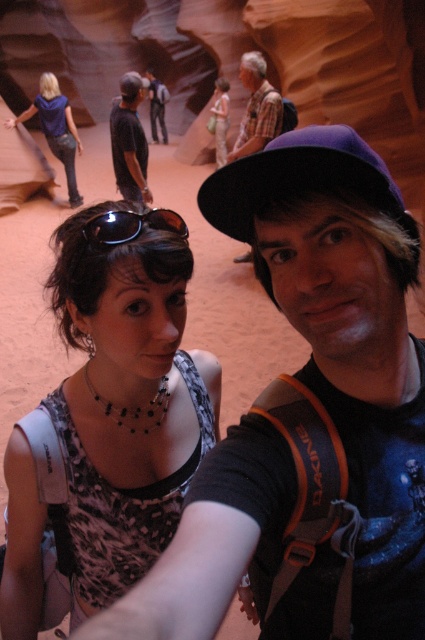
Does matte black hat at center have a greater width compared to matte blue shirt at upper left?

No.

Consider the image. Which is more to the right, matte black hat at center or matte blue shirt at upper left?

matte black hat at center is more to the right.

Locate an element on the screen. The height and width of the screenshot is (640, 425). matte black hat at center is located at coordinates (308, 416).

Between plaid shirt at center and sunglasses at center, which one appears on the right side from the viewer's perspective?

plaid shirt at center is more to the right.

Consider the image. Which is above, plaid shirt at center or sunglasses at center?

plaid shirt at center is higher up.

Who is more forward, (254, 122) or (119, 214)?

Point (119, 214) is more forward.

This screenshot has width=425, height=640. Identify the location of plaid shirt at center. (257, 108).

Who is lower down, sunglasses at center or light beige fabric dress at center?

sunglasses at center

Is sunglasses at center positioned behind light beige fabric dress at center?

No, it is not.

Identify the location of sunglasses at center. The image size is (425, 640). (130, 225).